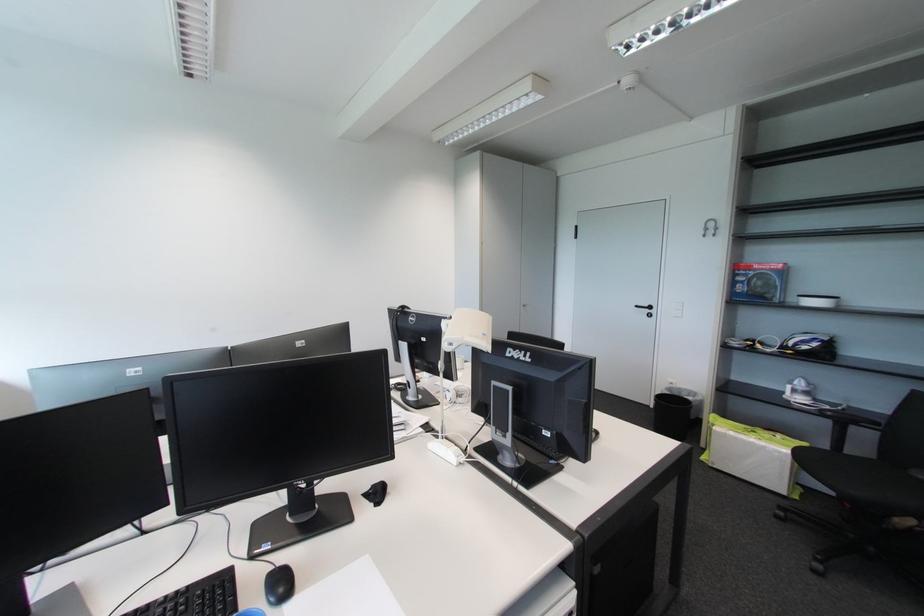
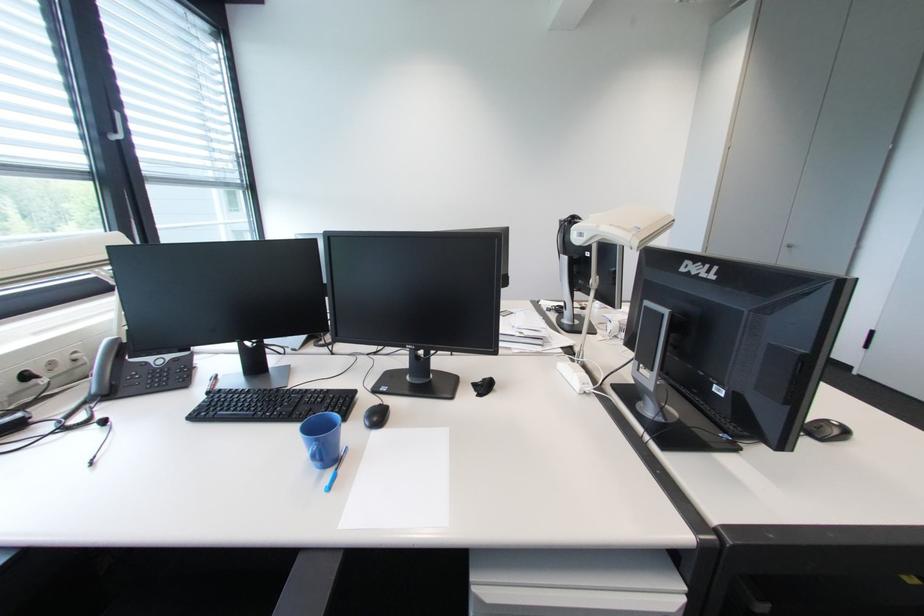
Question: The first image is from the beginning of the video and the second image is from the end. How did the camera likely rotate when shooting the video?

Choices:
 (A) Left
 (B) Right
 (C) Up
 (D) Down

Answer: (A)